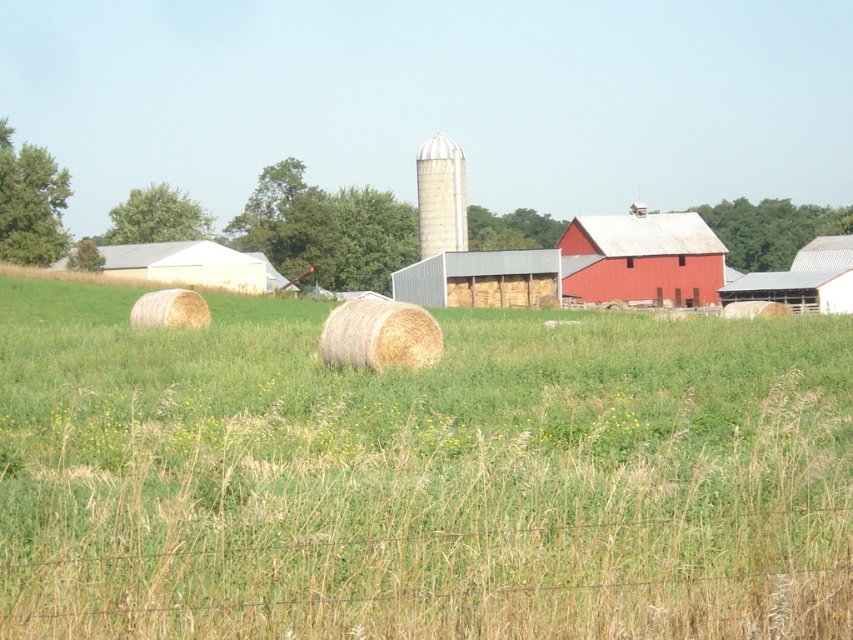
Does white matte barn at left have a greater height compared to beige straw bale at center?

Indeed, white matte barn at left has a greater height compared to beige straw bale at center.

Does point (270, 289) lie behind point (169, 312)?

That is True.

Does point (112, 262) lie behind point (158, 291)?

Yes, it is behind point (158, 291).

Image resolution: width=853 pixels, height=640 pixels. I want to click on white matte barn at left, so click(187, 264).

Which of these two, green grassy at center or metallic gray barn at center, stands shorter?

With less height is green grassy at center.

You are a GUI agent. You are given a task and a screenshot of the screen. Output one action in this format:
    pyautogui.click(x=<x>, y=<y>)
    Task: Click on the green grassy at center
    
    Given the screenshot: What is the action you would take?
    pyautogui.click(x=421, y=476)

Who is more distant from viewer, (440, 228) or (135, 316)?

Positioned behind is point (440, 228).

Describe the element at coordinates (440, 196) in the screenshot. The image size is (853, 640). I see `white textured silo at center` at that location.

Locate an element on the screen. white textured silo at center is located at coordinates (440, 196).